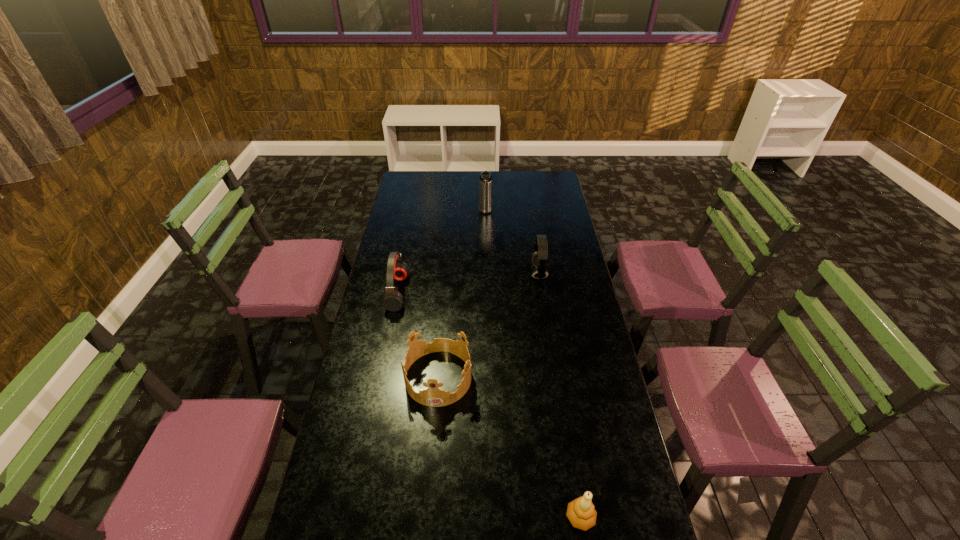
The height and width of the screenshot is (540, 960). I want to click on the tallest object, so click(x=485, y=181).

In order to click on the third object from right to left in this screenshot , I will do click(x=485, y=181).

Identify the location of the right earphone. Image resolution: width=960 pixels, height=540 pixels. (538, 259).

Find the location of `the left earphone`. the left earphone is located at coordinates (396, 269).

Where is `the fourth object from right to left`? This screenshot has width=960, height=540. the fourth object from right to left is located at coordinates (433, 397).

The image size is (960, 540). I want to click on tiara, so click(x=433, y=397).

This screenshot has height=540, width=960. I want to click on candle_holder, so click(x=581, y=513).

What are the coordinates of `vacant region located 0.200m on the handle side of the thermos bottle` in the screenshot? It's located at click(x=486, y=242).

Where is `free space located 0.350m on the ear cups of the right earphone`? Image resolution: width=960 pixels, height=540 pixels. free space located 0.350m on the ear cups of the right earphone is located at coordinates (450, 273).

Find the location of a particular element. Image resolution: width=960 pixels, height=540 pixels. free space located 0.160m on the ear cups of the right earphone is located at coordinates (493, 273).